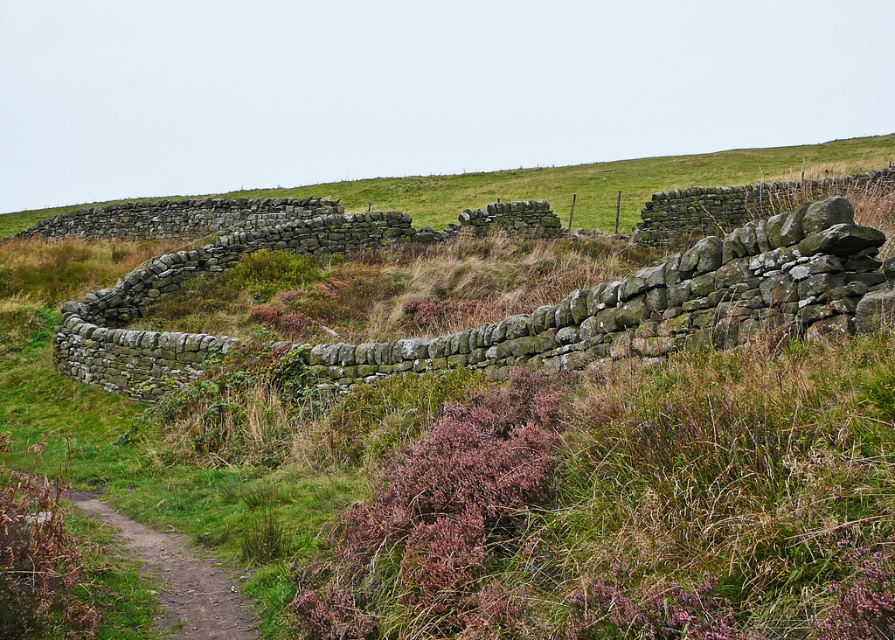
Question: Does green mossy stone wall at center appear over rustic stone wall at upper center?

Choices:
 (A) no
 (B) yes

Answer: (A)

Question: Where is rustic stone wall at upper center located in relation to dirt/gravel path at lower left in the image?

Choices:
 (A) below
 (B) above

Answer: (B)

Question: Is green mossy stone wall at center above rustic stone wall at upper center?

Choices:
 (A) yes
 (B) no

Answer: (B)

Question: Which point is closer to the camera?

Choices:
 (A) (657, 186)
 (B) (198, 576)

Answer: (B)

Question: Which object is farther from the camera taking this photo?

Choices:
 (A) green mossy stone wall at center
 (B) dirt/gravel path at lower left
 (C) rustic stone wall at upper center

Answer: (C)

Question: Which object is farther from the camera taking this photo?

Choices:
 (A) green mossy stone wall at center
 (B) rustic stone wall at upper center

Answer: (B)